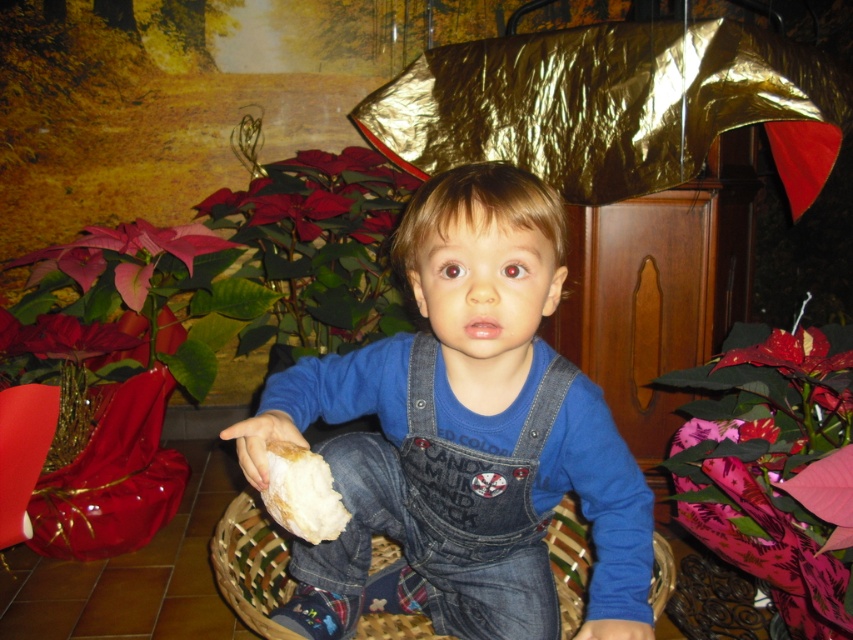
You are helping a parent organize their childs room. The child is wearing denim overalls at center and there is a woven wood basket at center. Which item takes up more space in the room?

The denim overalls at center is larger in size than the woven wood basket at center, so the denim overalls at center takes up more space in the room.

You are a delivery person who needs to place a small package in the woven wood basket at center. The package requires a minimum of 90 centimeters of space to be placed safely. Can you place the package in the basket?

The distance between the woven wood basket at center and the camera is 89.43 centimeters, which is less than the required 90 centimeters. Therefore, the package cannot be placed safely in the basket.

The child is holding the white crumbly bread at center. If the child wants to place the bread on the denim overalls at center, will it fit without falling over?

The denim overalls at center is much taller than the white crumbly bread at center, so placing the bread on top would be stable and it won,t fall over.